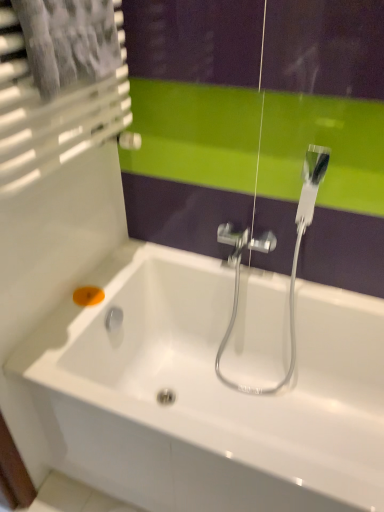
Question: From the image's perspective, relative to orange matte soap at lower left, is white glossy bathtub at center above or below?

Choices:
 (A) above
 (B) below

Answer: (B)

Question: Looking at their shapes, would you say white glossy bathtub at center is wider or thinner than orange matte soap at lower left?

Choices:
 (A) wide
 (B) thin

Answer: (A)

Question: Is white glossy bathtub at center taller or shorter than orange matte soap at lower left?

Choices:
 (A) short
 (B) tall

Answer: (B)

Question: Which is correct: orange matte soap at lower left is inside white glossy bathtub at center, or outside of it?

Choices:
 (A) inside
 (B) outside

Answer: (A)

Question: From the image's perspective, relative to white glossy bathtub at center, is orange matte soap at lower left above or below?

Choices:
 (A) above
 (B) below

Answer: (A)

Question: From a real-world perspective, relative to white glossy bathtub at center, is orange matte soap at lower left vertically above or below?

Choices:
 (A) above
 (B) below

Answer: (A)

Question: Based on their positions, is orange matte soap at lower left located to the left or right of white glossy bathtub at center?

Choices:
 (A) right
 (B) left

Answer: (B)